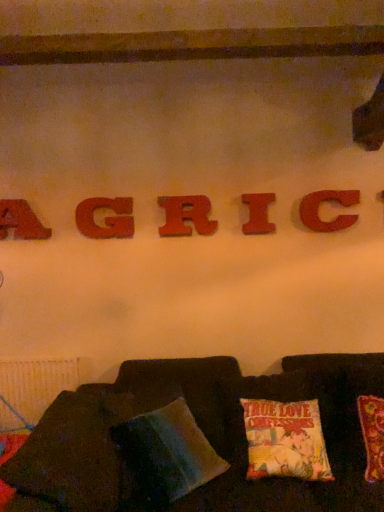
Question: Is wooden letter a at upper left, the 5th letter in the right-to-left sequence, wider or thinner than multicolored fabric pillow at lower center?

Choices:
 (A) thin
 (B) wide

Answer: (A)

Question: Is point [24, 217] closer or farther from the camera than point [201, 472]?

Choices:
 (A) closer
 (B) farther

Answer: (B)

Question: Estimate the real-world distances between objects in this image. Which object is closer to the multicolored fabric pillow at lower center?

Choices:
 (A) wooden letter a at upper left, the 5th letter in the right-to-left sequence
 (B) matte wood letter i at center, which appears as the 2th letter when viewed from the right
 (C) wooden letter c at center, which is the 1th letter in right-to-left order
 (D) wooden letter r at center, the third letter from the right
 (E) matte wooden letter g at center, marked as the second letter in a left-to-right arrangement

Answer: (D)

Question: Estimate the real-world distances between objects in this image. Which object is closer to the velvet cushion at lower center?

Choices:
 (A) wooden letter r at center, the 3th letter from the left
 (B) matte wood letter i at center, the fourth letter when ordered from left to right
 (C) multicolored fabric pillow at lower center
 (D) wooden letter c at center, which ranks as the fifth letter in left-to-right order
 (E) matte wooden letter g at center, which is counted as the 4th letter, starting from the right

Answer: (C)